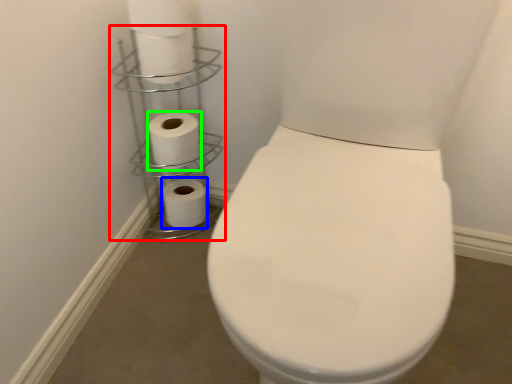
Question: Considering the real-world distances, which object is farthest from shelf (highlighted by a red box)? toilet paper (highlighted by a blue box) or toilet paper (highlighted by a green box)?

Choices:
 (A) toilet paper
 (B) toilet paper

Answer: (A)